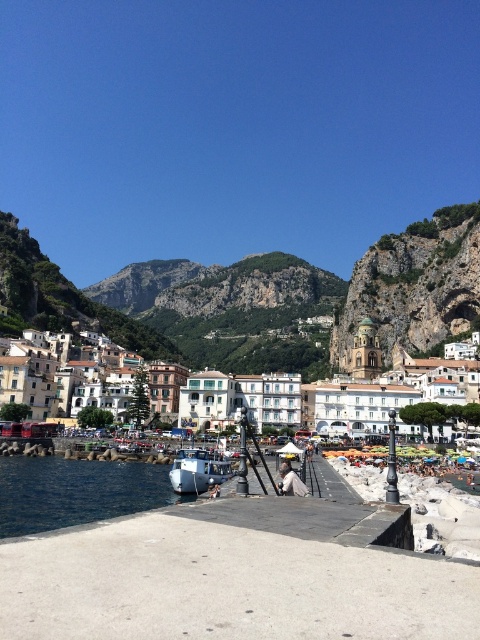
Question: From the image, what is the correct spatial relationship of white stucco buildings at center in relation to white matte boat at center?

Choices:
 (A) right
 (B) left

Answer: (A)

Question: Can you confirm if white stucco buildings at center is positioned above deep blue water at lower left?

Choices:
 (A) yes
 (B) no

Answer: (A)

Question: Does deep blue water at lower left have a smaller size compared to white matte boat at center?

Choices:
 (A) yes
 (B) no

Answer: (B)

Question: Estimate the real-world distances between objects in this image. Which object is farther from the deep blue water at lower left?

Choices:
 (A) white stucco buildings at center
 (B) white matte boat at center

Answer: (A)

Question: Among these points, which one is nearest to the camera?

Choices:
 (A) pyautogui.click(x=194, y=456)
 (B) pyautogui.click(x=402, y=412)
 (C) pyautogui.click(x=11, y=488)

Answer: (C)

Question: Which of the following is the closest to the observer?

Choices:
 (A) deep blue water at lower left
 (B) white stucco buildings at center

Answer: (A)